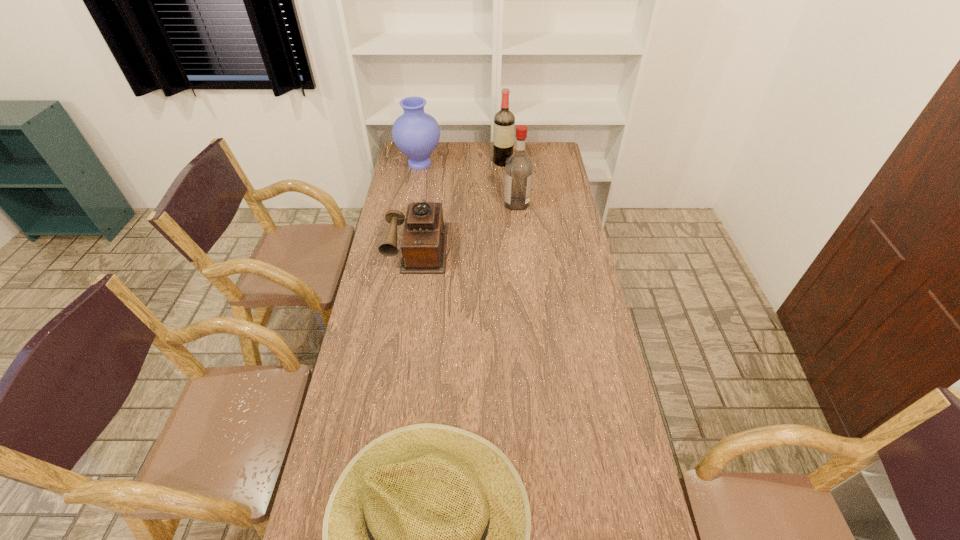
You are a GUI agent. You are given a task and a screenshot of the screen. Output one action in this format:
    pyautogui.click(x=<x>, y=<y>)
    Task: Click on the liquor present at the far edge
    The width and height of the screenshot is (960, 540).
    Given the screenshot: What is the action you would take?
    pyautogui.click(x=504, y=121)

Where is `vase present at the far edge`? The image size is (960, 540). vase present at the far edge is located at coordinates (416, 133).

Where is `vase that is at the left edge`? The height and width of the screenshot is (540, 960). vase that is at the left edge is located at coordinates [416, 133].

At what (x,y) coordinates should I click in order to perform the action: click on phonograph_record positioned at the left edge. Please return your answer as a coordinate pair (x, y). The height and width of the screenshot is (540, 960). Looking at the image, I should click on (424, 241).

Identify the location of object that is at the far left corner. (416, 133).

Identify the location of vacant space at the left edge of the desktop. (370, 380).

Where is `free spot at the right edge of the desktop`? Image resolution: width=960 pixels, height=540 pixels. free spot at the right edge of the desktop is located at coordinates (624, 491).

You are a GUI agent. You are given a task and a screenshot of the screen. Output one action in this format:
    pyautogui.click(x=<x>, y=<y>)
    Task: Click on the vacant point at the far right corner
    This screenshot has width=960, height=540.
    Given the screenshot: What is the action you would take?
    pyautogui.click(x=544, y=150)

Identify the location of vacant area between the vase and the third nearest object. (468, 184).

At what (x,y) coordinates should I click in order to perform the action: click on free space between the farther liquor and the vase. Please return your answer as a coordinate pair (x, y). This screenshot has height=540, width=960. Looking at the image, I should click on (461, 163).